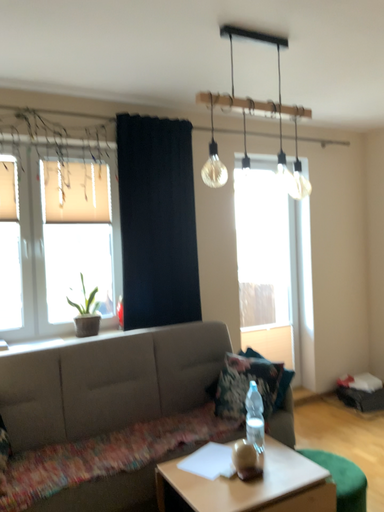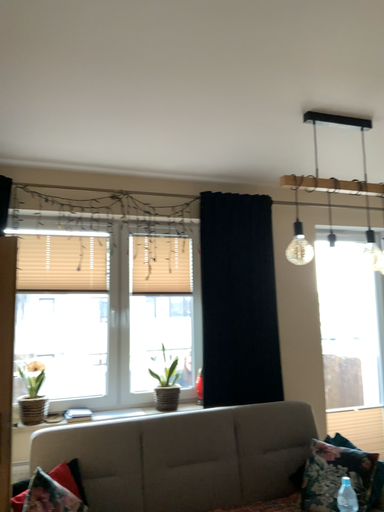
Question: Which way did the camera rotate in the video?

Choices:
 (A) rotated left
 (B) rotated right

Answer: (A)